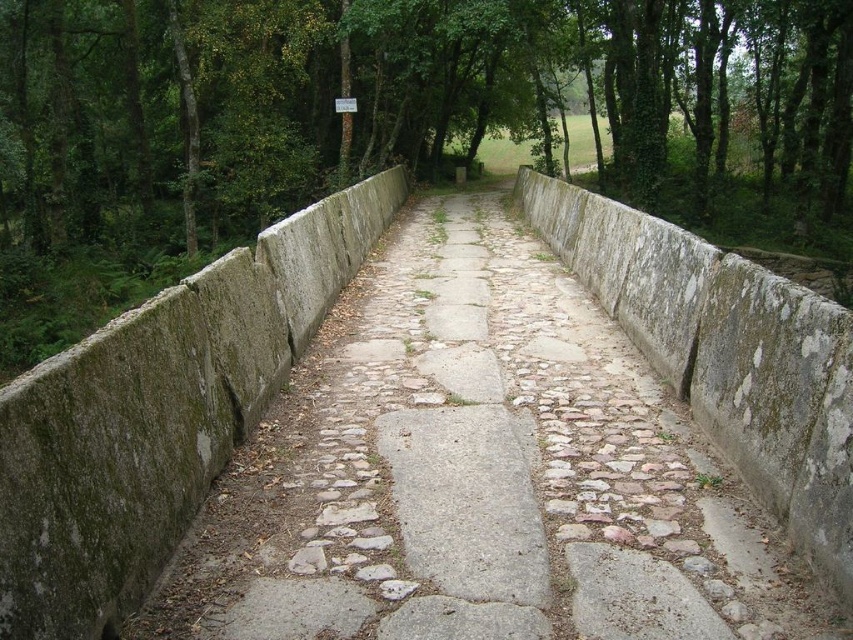
Question: Which point is farther from the camera taking this photo?

Choices:
 (A) (833, 182)
 (B) (653, 508)

Answer: (A)

Question: Can you confirm if gray stone path at center is positioned below green leafy tree at center?

Choices:
 (A) yes
 (B) no

Answer: (A)

Question: Is gray stone path at center to the left of green leafy tree at center from the viewer's perspective?

Choices:
 (A) no
 (B) yes

Answer: (B)

Question: Is gray stone path at center smaller than green leafy tree at center?

Choices:
 (A) yes
 (B) no

Answer: (A)